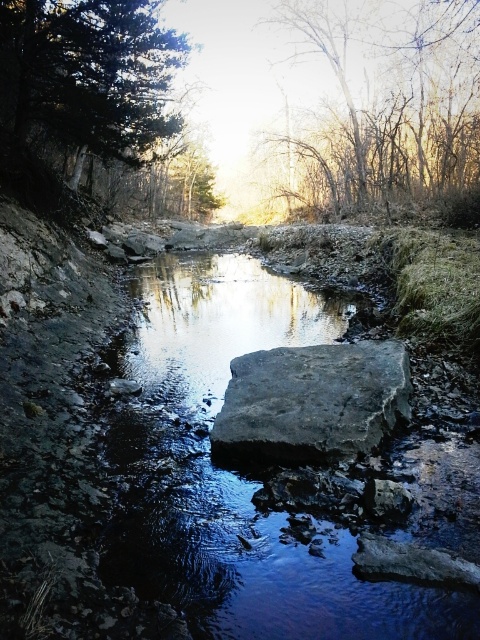
Question: Which of the following is the closest to the observer?

Choices:
 (A) (105, 8)
 (B) (396, 611)
 (C) (344, 416)
 (D) (460, 64)

Answer: (B)

Question: Considering the real-world distances, which object is farthest from the smooth stone stream at center?

Choices:
 (A) smooth bark trees at upper center
 (B) dark green textured tree trunk at upper left

Answer: (A)

Question: Can you confirm if dark green textured tree trunk at upper left is positioned below smooth bark trees at upper center?

Choices:
 (A) no
 (B) yes

Answer: (B)

Question: Which of the following is the farthest from the observer?

Choices:
 (A) dark green textured tree trunk at upper left
 (B) smooth bark trees at upper center
 (C) smooth stone stream at center

Answer: (B)

Question: From the image, what is the correct spatial relationship of dark green textured tree trunk at upper left in relation to gray rough rock at center?

Choices:
 (A) below
 (B) above

Answer: (B)

Question: Does dark green textured tree trunk at upper left have a greater width compared to gray rough rock at center?

Choices:
 (A) yes
 (B) no

Answer: (A)